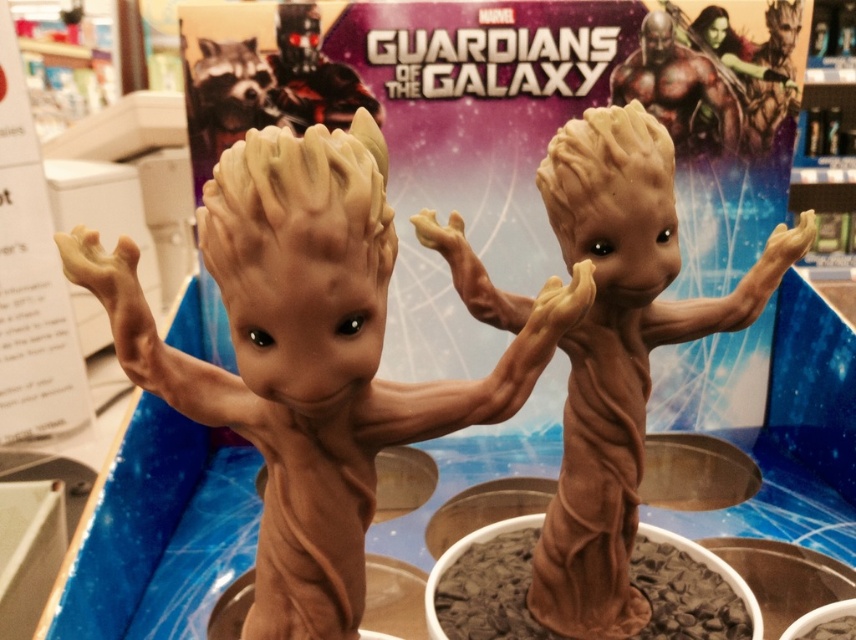
You are a collector who wants to display both the brown rubbery tree at center and the matte black figure at upper center on a shelf. Given that the shelf has limited vertical space, which of the two items should you place first to ensure both fit vertically?

The brown rubbery tree at center is taller than the matte black figure at upper center, so you should place the shorter matte black figure at upper center first to accommodate the taller brown rubbery tree at center.

Consider the image. You are a collector examining two points on the Groot figurines displayed in the Guardians of the Galaxy promotional backdrop. The points are labeled as point 1 at coordinates point [138,305] and point 2 at coordinates point [214,116]. Which point is positioned closer to your viewpoint?

Point [138,305] is closer to the viewer than point [214,116].